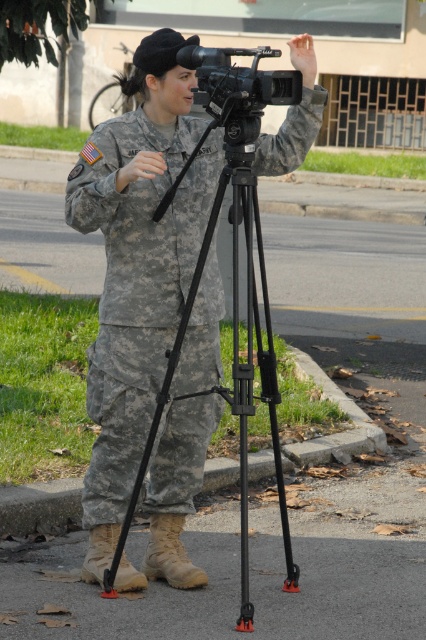
Question: Among these points, which one is farthest from the camera?

Choices:
 (A) (106, 509)
 (B) (259, 342)
 (C) (215, 88)

Answer: (A)

Question: Can you confirm if camouflage fabric uniform at center is smaller than black matte tripod at center?

Choices:
 (A) yes
 (B) no

Answer: (A)

Question: Is camouflage fabric uniform at center positioned before black matte camera at center?

Choices:
 (A) no
 (B) yes

Answer: (A)

Question: Which is farther from the black matte camera at center?

Choices:
 (A) camouflage fabric uniform at center
 (B) black matte tripod at center

Answer: (B)

Question: Can you confirm if black matte tripod at center is positioned to the right of black matte camera at center?

Choices:
 (A) no
 (B) yes

Answer: (A)

Question: Which of the following is the farthest from the observer?

Choices:
 (A) black matte camera at center
 (B) camouflage fabric uniform at center
 (C) black matte tripod at center

Answer: (B)